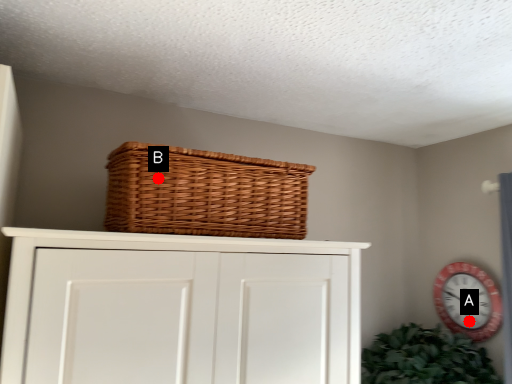
Question: Two points are circled on the image, labeled by A and B beside each circle. Among these points, which one is nearest to the camera?

Choices:
 (A) A is closer
 (B) B is closer

Answer: (B)